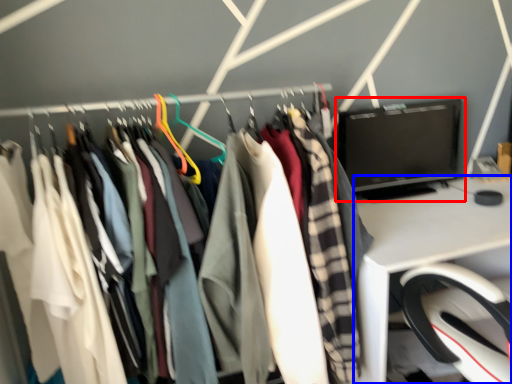
Question: Among these objects, which one is farthest to the camera, computer monitor (highlighted by a red box) or desk (highlighted by a blue box)?

Choices:
 (A) computer monitor
 (B) desk

Answer: (A)